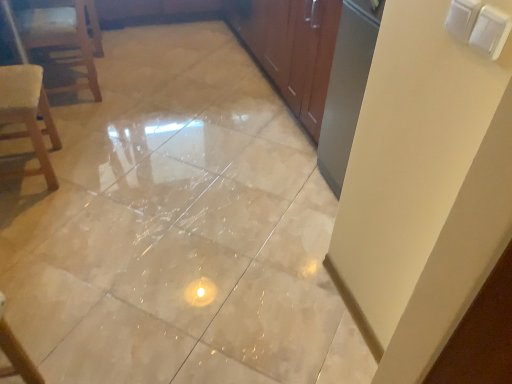
Identify the location of vacant area on the back side of wooden textured chair at left. (83, 132).